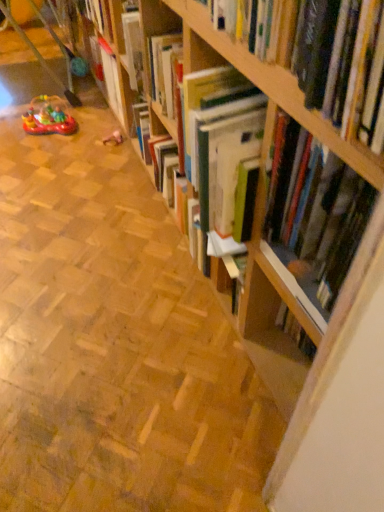
At what (x,y) coordinates should I click in order to perform the action: click on blank area to the left of rubberized plastic toy at center, the second toy in the left-to-right sequence. Please return your answer as a coordinate pair (x, y). Image resolution: width=384 pixels, height=512 pixels. Looking at the image, I should click on (83, 144).